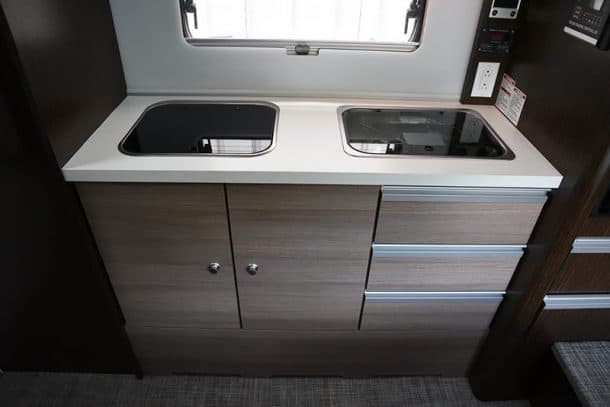
Identify the location of thermostat. The image size is (610, 407). (590, 32).